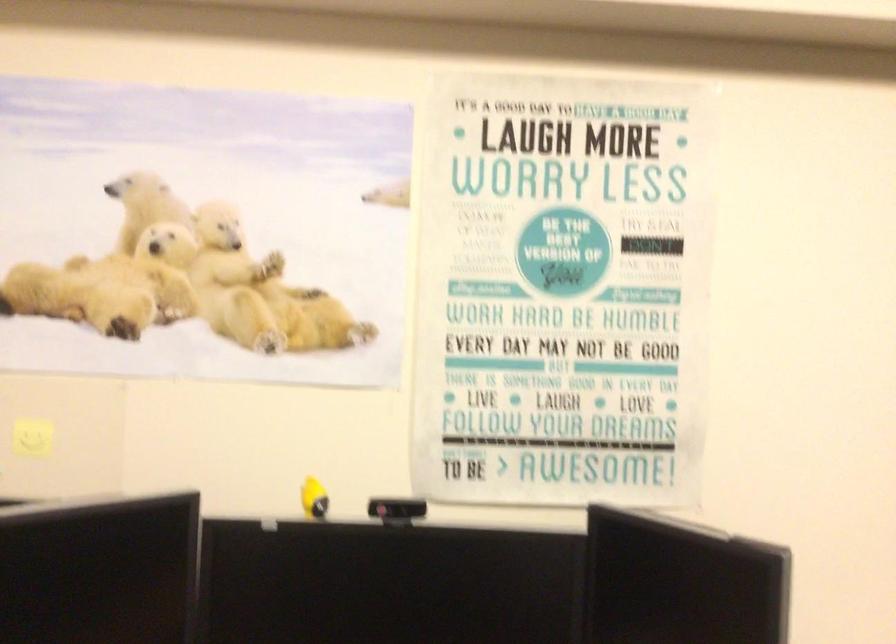
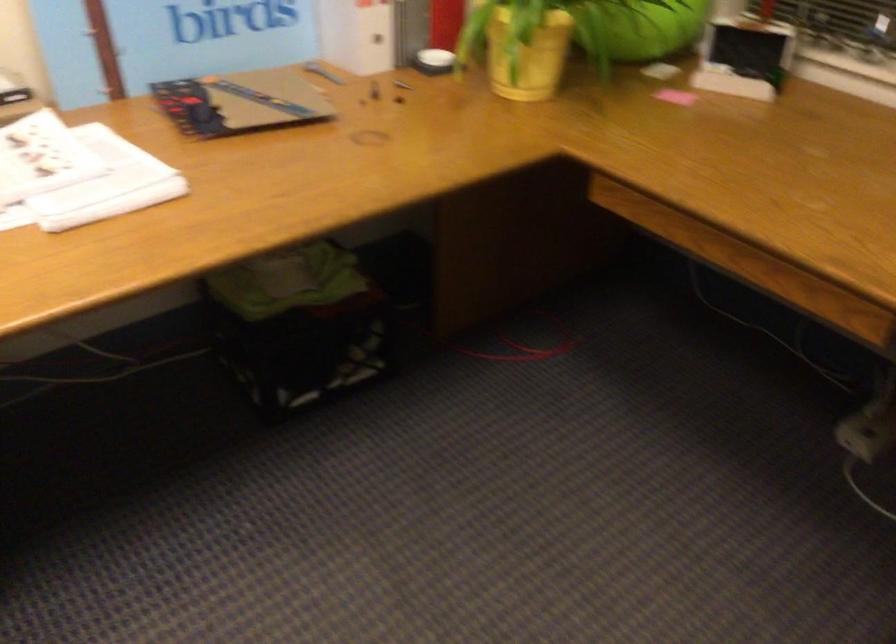
The images are taken continuously from a first-person perspective. In which direction is your viewpoint rotating?

The rotation direction of the camera is right-down.